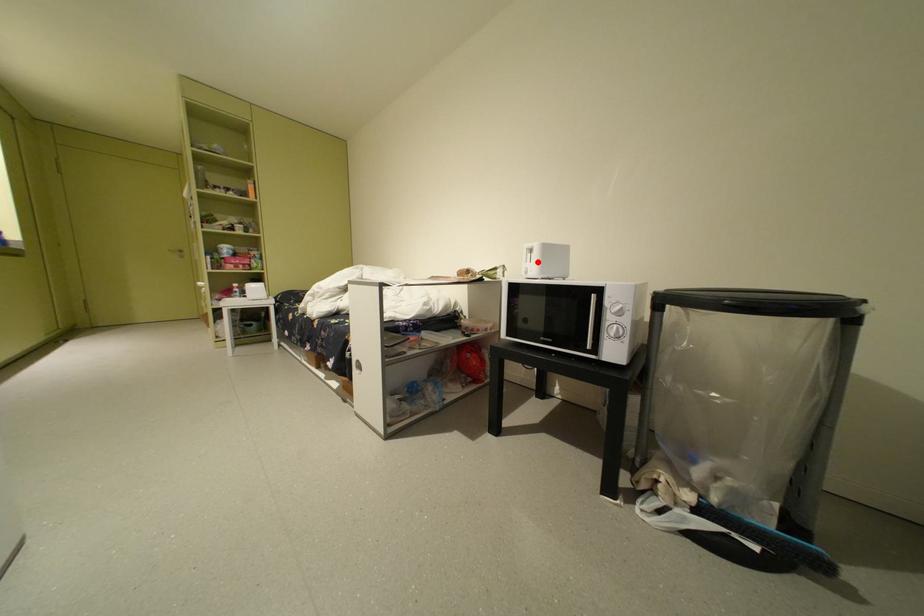
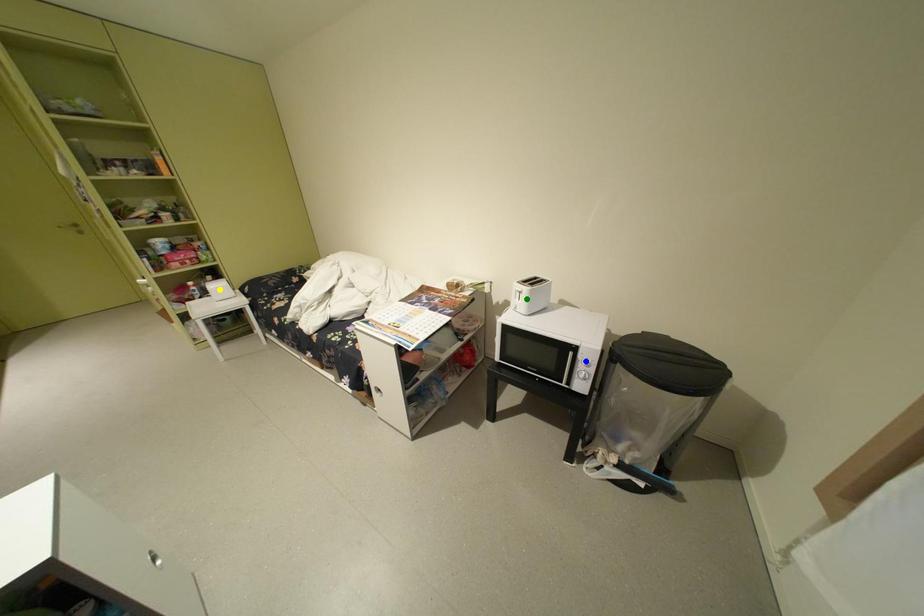
Question: I am providing you with two images of the same scene from different viewpoints. A red point is marked on the first image. You are given multiple points on the second image. In image 2, which mark is for the same physical point as the one in image 1?

Choices:
 (A) yellow point
 (B) green point
 (C) blue point

Answer: (B)